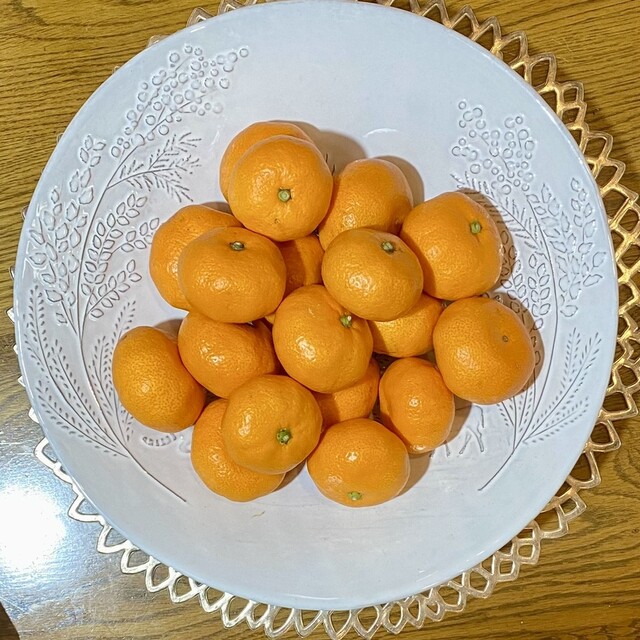
This screenshot has height=640, width=640. I want to click on white plate, so click(397, 560).